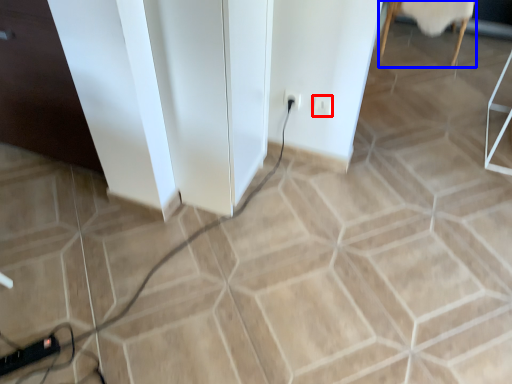
Question: Which object appears closest to the camera in this image, socket (highlighted by a red box) or furniture (highlighted by a blue box)?

Choices:
 (A) socket
 (B) furniture

Answer: (A)